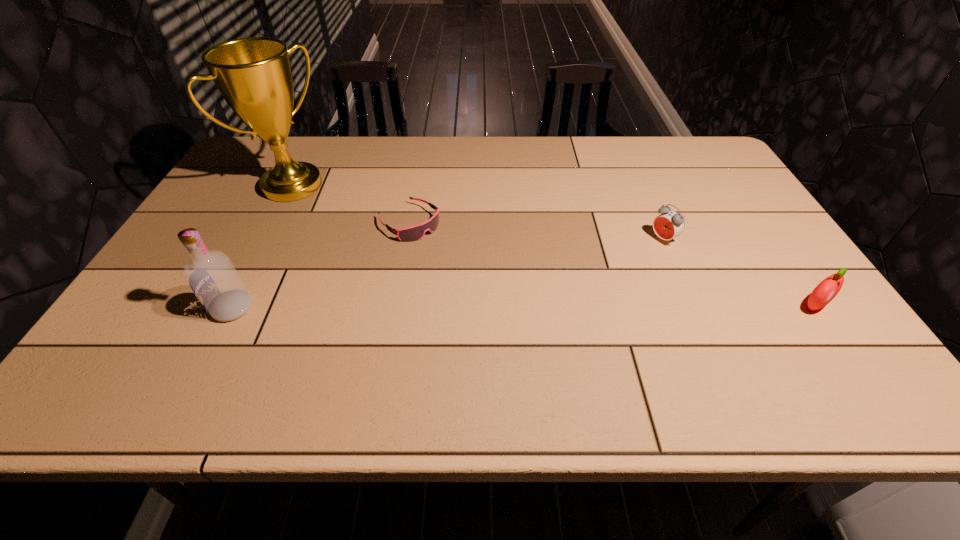
I want to click on vacant spot on the desktop that is between the vodka and the apple and is positioned on the front-facing side of the shortest object, so click(x=513, y=307).

The height and width of the screenshot is (540, 960). In order to click on free spot on the desktop that is between the vodka and the apple and is positioned on the face of the alarm clock in this screenshot , I will do `click(549, 307)`.

This screenshot has width=960, height=540. What are the coordinates of `vacant spot on the desktop that is between the vodka and the rightmost object and is positioned by the handles of the award` in the screenshot? It's located at (482, 307).